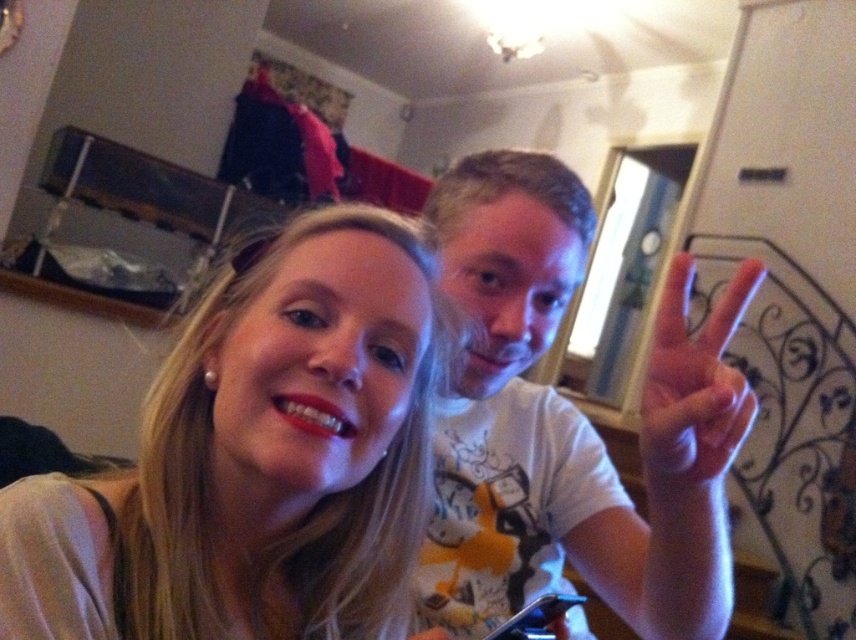
Looking at this image, which is more to the left, white matte t-shirt at center or pink matte hand at center right?

From the viewer's perspective, white matte t-shirt at center appears more on the left side.

Which is in front, point (456, 275) or point (723, 419)?

Point (723, 419)

The width and height of the screenshot is (856, 640). In order to click on white matte t-shirt at center in this screenshot , I will do `click(569, 422)`.

Can you confirm if smooth beige shirt at center is positioned to the right of pink matte hand at center right?

No, smooth beige shirt at center is not to the right of pink matte hand at center right.

Which is behind, point (42, 486) or point (660, 300)?

The point (660, 300) is more distant.

Locate an element on the screen. This screenshot has height=640, width=856. smooth beige shirt at center is located at coordinates (257, 458).

Based on the photo, is smooth beige shirt at center wider than white matte t-shirt at center?

In fact, smooth beige shirt at center might be narrower than white matte t-shirt at center.

Does point (296, 449) lie in front of point (535, 360)?

Yes.

Is point (288, 236) closer to viewer compared to point (598, 561)?

Yes, point (288, 236) is in front of point (598, 561).

Locate an element on the screen. smooth beige shirt at center is located at coordinates (257, 458).